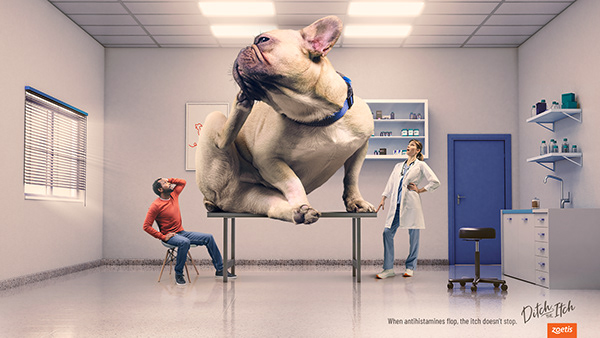
Locate an element on the screen. chair is located at coordinates (x=170, y=264), (x=480, y=233).